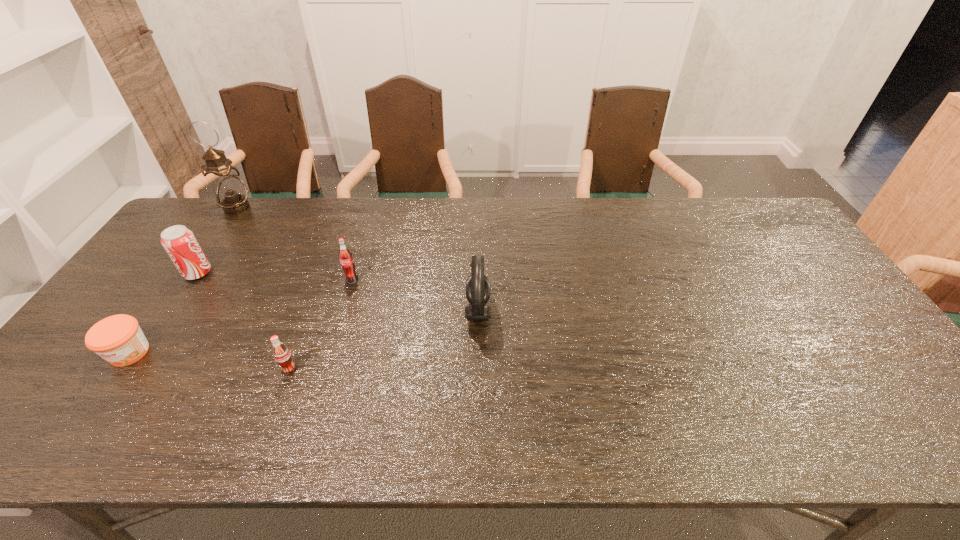
What are the coordinates of `free location that satisfies the following two spatial constraints: 1. on the earcups of the headset; 2. on the front label of the shortest object` in the screenshot? It's located at (478, 353).